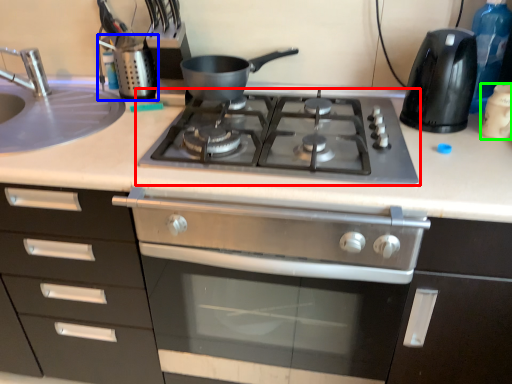
Question: Based on their relative distances, which object is farther from gas stove (highlighted by a red box)? Choose from appliance (highlighted by a blue box) and kitchen appliance (highlighted by a green box).

Choices:
 (A) appliance
 (B) kitchen appliance

Answer: (B)